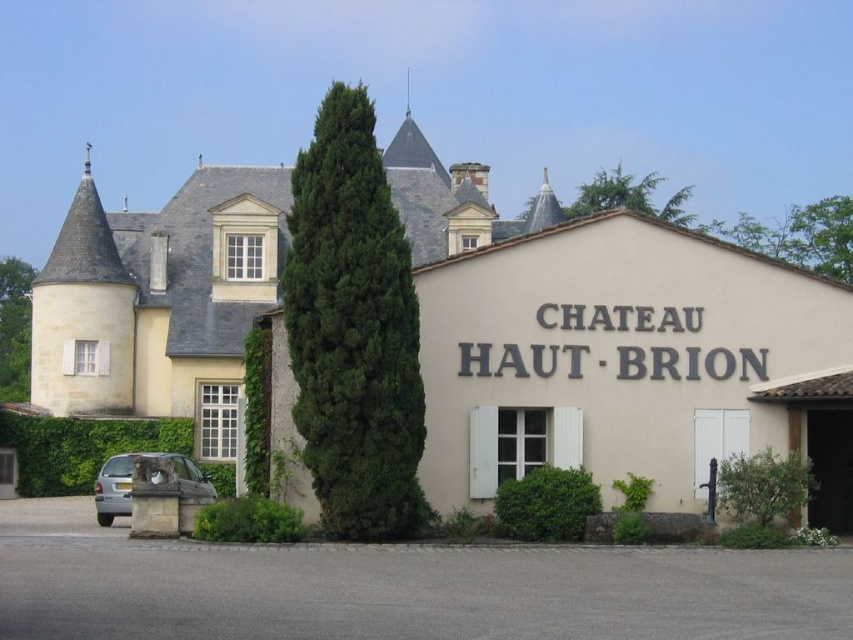
Question: Which point is farther to the camera?

Choices:
 (A) beige stone building at center
 (B) silver metallic car at lower left

Answer: (B)

Question: Can you confirm if beige stone building at center is wider than silver metallic car at lower left?

Choices:
 (A) no
 (B) yes

Answer: (B)

Question: Which of the following is the closest to the observer?

Choices:
 (A) (115, 364)
 (B) (202, 493)

Answer: (B)

Question: Observing the image, what is the correct spatial positioning of beige stone building at center in reference to silver metallic car at lower left?

Choices:
 (A) right
 (B) left

Answer: (B)

Question: Is beige stone building at center bigger than silver metallic car at lower left?

Choices:
 (A) yes
 (B) no

Answer: (A)